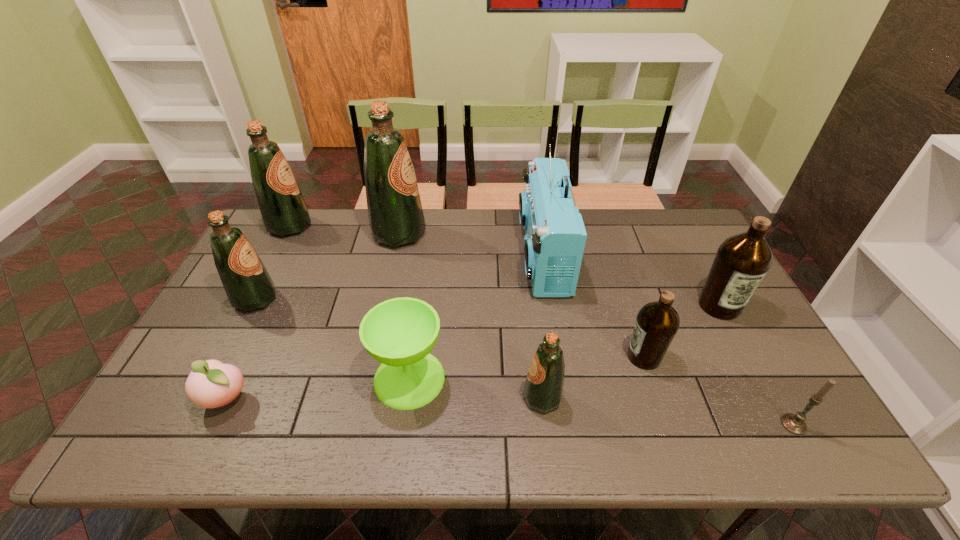
Find the location of a particular element. Image resolution: width=960 pixels, height=540 pixels. the second olive oil from right to left is located at coordinates (657, 323).

Find the location of a particular element. The width and height of the screenshot is (960, 540). green wineglass is located at coordinates (399, 333).

Where is `candle`? candle is located at coordinates (795, 424).

Find the location of a particular element. This screenshot has height=540, width=960. pink peach is located at coordinates (211, 384).

What are the coordinates of `peach` in the screenshot? It's located at (211, 384).

Where is `vacant space located 0.250m on the front-facing side of the tallest object`? Image resolution: width=960 pixels, height=540 pixels. vacant space located 0.250m on the front-facing side of the tallest object is located at coordinates (x=499, y=234).

The height and width of the screenshot is (540, 960). Find the location of `vacant space located on the front-facing side of the second biggest green olive oil`. vacant space located on the front-facing side of the second biggest green olive oil is located at coordinates (409, 226).

This screenshot has width=960, height=540. I want to click on free spot located on the front-facing side of the radio receiver, so click(403, 256).

What are the coordinates of `vacant space located on the front-facing side of the radio receiver` in the screenshot? It's located at (397, 256).

You are a GUI agent. You are given a task and a screenshot of the screen. Output one action in this format:
    pyautogui.click(x=<x>, y=<y>)
    Task: Click on the vacant space located on the front-facing side of the radio receiver
    
    Given the screenshot: What is the action you would take?
    pyautogui.click(x=456, y=256)